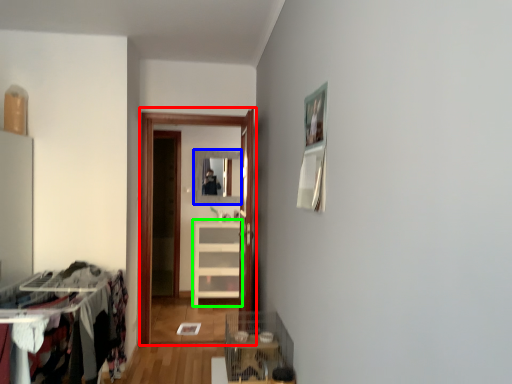
Question: Based on their relative distances, which object is farther from glass door (highlighted by a red box)? Choose from mirror (highlighted by a blue box) and cabinetry (highlighted by a green box).

Choices:
 (A) mirror
 (B) cabinetry

Answer: (A)